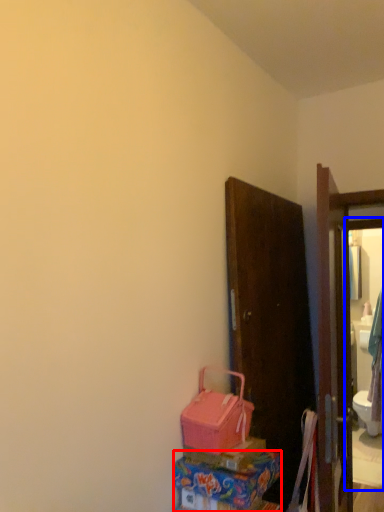
Question: Which point is further to the camera, box (highlighted by a red box) or mirror (highlighted by a blue box)?

Choices:
 (A) box
 (B) mirror

Answer: (B)